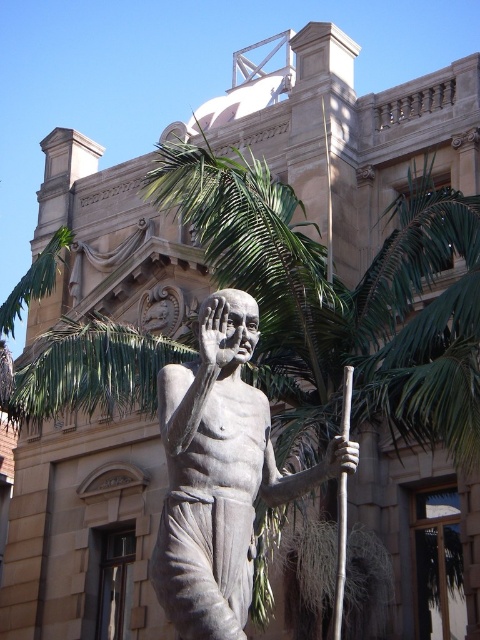
You are an architect designing a new plaza and want to place both the bronze statue at center and the brown wood pole at center along a walkway. Given their sizes, which object should be placed first to ensure they are spaced appropriately?

The bronze statue at center should be placed first because it is wider than the brown wood pole at center, ensuring proper spacing between them.

You are standing in front of the statue and want to take a photo that includes both the bronze statue at center and the brown wood pole at center. Based on their positions, which object should you position closer to the left side of your camera frame?

The bronze statue at center should be positioned closer to the left side of your camera frame since it is already located to the left of the brown wood pole at center in the scene.